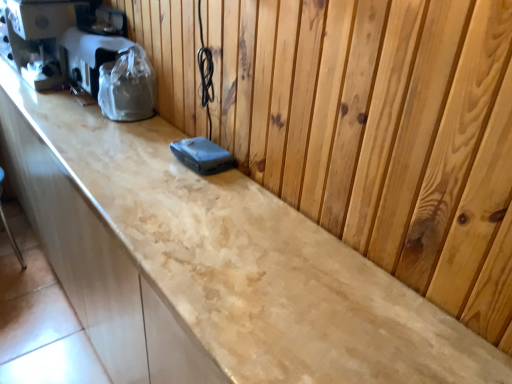
Question: From a real-world perspective, is plastic-wrapped appliance at left located higher than matte black coffee machine at left?

Choices:
 (A) yes
 (B) no

Answer: (B)

Question: Is plastic-wrapped appliance at left positioned with its back to matte black coffee machine at left?

Choices:
 (A) yes
 (B) no

Answer: (B)

Question: Is plastic-wrapped appliance at left bigger than matte black coffee machine at left?

Choices:
 (A) yes
 (B) no

Answer: (B)

Question: Does plastic-wrapped appliance at left touch matte black coffee machine at left?

Choices:
 (A) yes
 (B) no

Answer: (B)

Question: From a real-world perspective, is plastic-wrapped appliance at left located beneath matte black coffee machine at left?

Choices:
 (A) no
 (B) yes

Answer: (B)

Question: From the image's perspective, is plastic-wrapped appliance at left under matte black coffee machine at left?

Choices:
 (A) yes
 (B) no

Answer: (A)

Question: From the image's perspective, is matte black coffee machine at left below plastic-wrapped appliance at left?

Choices:
 (A) yes
 (B) no

Answer: (B)

Question: Can you confirm if matte black coffee machine at left is positioned to the right of plastic-wrapped appliance at left?

Choices:
 (A) yes
 (B) no

Answer: (B)

Question: Can you confirm if matte black coffee machine at left is positioned to the left of plastic-wrapped appliance at left?

Choices:
 (A) yes
 (B) no

Answer: (A)

Question: From a real-world perspective, does matte black coffee machine at left stand above plastic-wrapped appliance at left?

Choices:
 (A) yes
 (B) no

Answer: (A)

Question: Is matte black coffee machine at left smaller than plastic-wrapped appliance at left?

Choices:
 (A) yes
 (B) no

Answer: (B)

Question: Does matte black coffee machine at left have a greater width compared to plastic-wrapped appliance at left?

Choices:
 (A) yes
 (B) no

Answer: (A)

Question: From the image's perspective, is matte black coffee machine at left above or below plastic-wrapped appliance at left?

Choices:
 (A) above
 (B) below

Answer: (A)